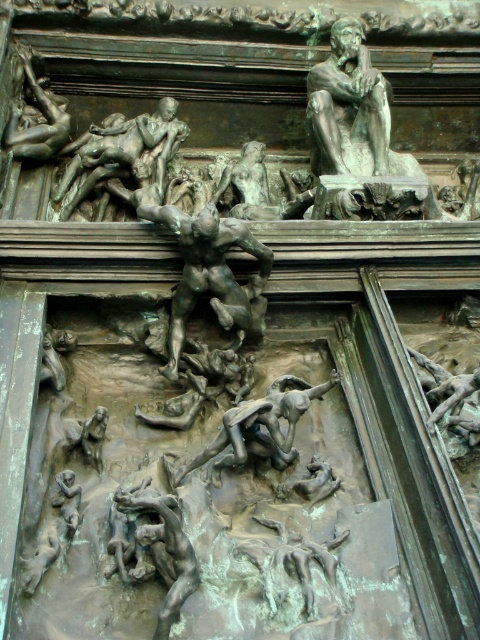
Question: Which point appears farthest from the camera in this image?

Choices:
 (A) (180, 595)
 (B) (190, 218)

Answer: (B)

Question: Does bronze textured figures at upper left appear on the right side of bronze textured figure at center?

Choices:
 (A) yes
 (B) no

Answer: (B)

Question: Can you confirm if bronze textured figures at upper left is thinner than bronze textured figure at lower left?

Choices:
 (A) yes
 (B) no

Answer: (B)

Question: Among these objects, which one is farthest from the camera?

Choices:
 (A) bronze textured figure at center
 (B) bronze textured figure at lower left
 (C) bronze textured figures at upper left

Answer: (C)

Question: Which object is the farthest from the bronze textured figure at center?

Choices:
 (A) bronze textured figure at lower left
 (B) bronze textured figures at upper left

Answer: (B)

Question: Can you confirm if bronze textured figures at upper left is positioned to the left of bronze textured figure at lower left?

Choices:
 (A) yes
 (B) no

Answer: (A)